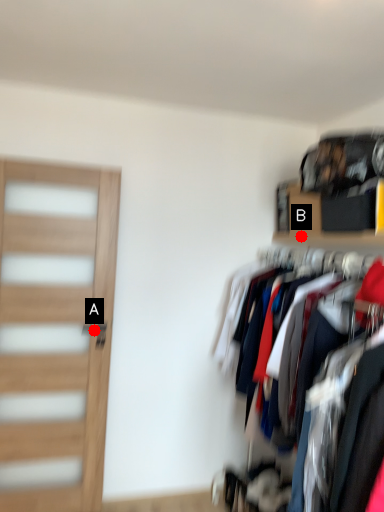
Question: Two points are circled on the image, labeled by A and B beside each circle. Which point appears farthest from the camera in this image?

Choices:
 (A) A is further
 (B) B is further

Answer: (A)